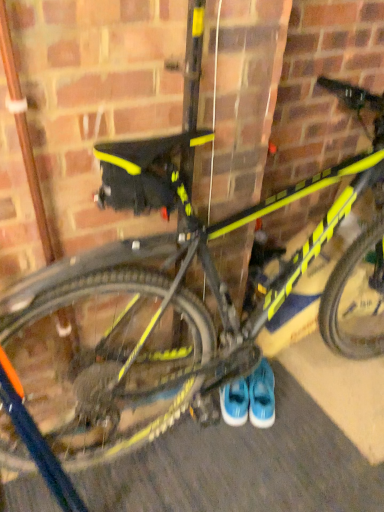
Where is `unoccupied area in front of blue suede sneakers at center, the 1th footwear positioned from the right`? unoccupied area in front of blue suede sneakers at center, the 1th footwear positioned from the right is located at coordinates (266, 439).